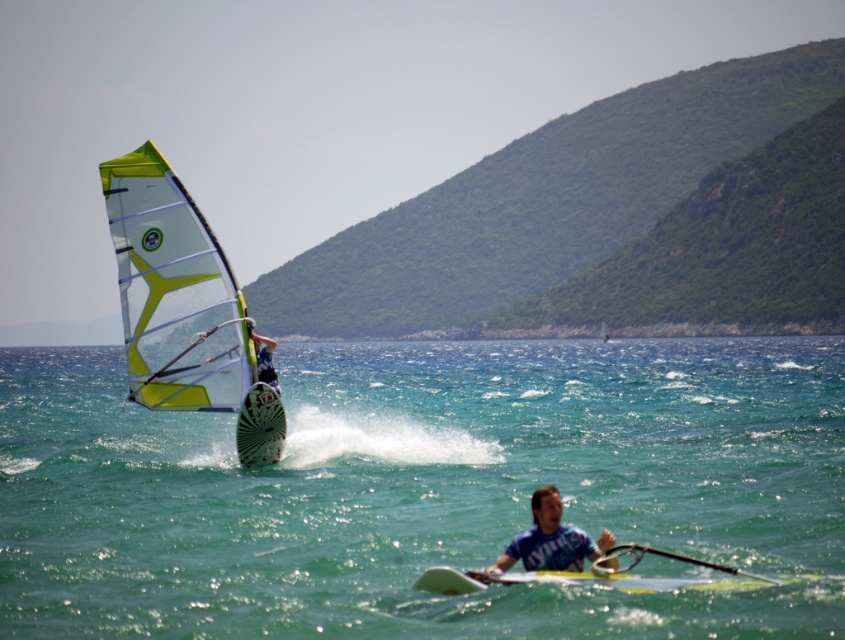
Can you confirm if blue jersey at center is positioned below yellow-green sail at upper left?

Indeed, blue jersey at center is positioned under yellow-green sail at upper left.

Does point (570, 536) come in front of point (249, 332)?

Yes, it is in front of point (249, 332).

What do you see at coordinates (551, 540) in the screenshot? The height and width of the screenshot is (640, 845). I see `blue jersey at center` at bounding box center [551, 540].

Locate an element on the screen. The height and width of the screenshot is (640, 845). blue jersey at center is located at coordinates (551, 540).

Who is more distant from viewer, (173, 182) or (538, 561)?

The point (173, 182) is more distant.

Is transparent plastic sail at left to the right of blue jersey at center from the viewer's perspective?

No, transparent plastic sail at left is not to the right of blue jersey at center.

Where is `transparent plastic sail at left`? This screenshot has height=640, width=845. transparent plastic sail at left is located at coordinates (183, 307).

Does transparent plastic sail at left have a lesser height compared to yellow-green sail at upper left?

Indeed, transparent plastic sail at left has a lesser height compared to yellow-green sail at upper left.

Which of these two, transparent plastic sail at left or yellow-green sail at upper left, stands taller?

yellow-green sail at upper left

Between point (150, 369) and point (271, 339), which one is positioned behind?

Positioned behind is point (150, 369).

Image resolution: width=845 pixels, height=640 pixels. I want to click on transparent plastic sail at left, so pos(183,307).